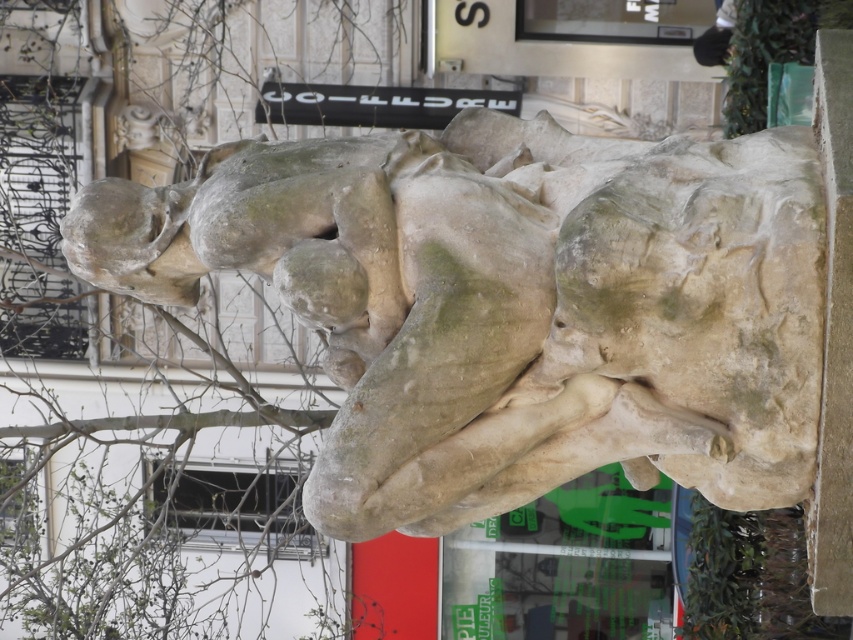
Can you confirm if stone statue at center is wider than smooth stone head at center?

Yes.

Measure the distance between stone statue at center and smooth stone head at center.

14.64 inches

Which is behind, point (616, 451) or point (337, 243)?

The point (616, 451) is more distant.

Find the location of `stone statue at center`. stone statue at center is located at coordinates (518, 307).

Can you confirm if stone statue at center is positioned above stone head at upper left?

No.

Can you confirm if stone statue at center is positioned to the right of stone head at upper left?

Yes, stone statue at center is to the right of stone head at upper left.

Measure the distance between point (814,147) and camera.

8.18 meters

The width and height of the screenshot is (853, 640). I want to click on stone statue at center, so click(518, 307).

Is stone head at upper left to the left of smooth stone head at center from the viewer's perspective?

Yes, stone head at upper left is to the left of smooth stone head at center.

Is point (107, 284) more distant than point (309, 317)?

Yes, point (107, 284) is farther from viewer.

Locate an element on the screen. stone head at upper left is located at coordinates (134, 240).